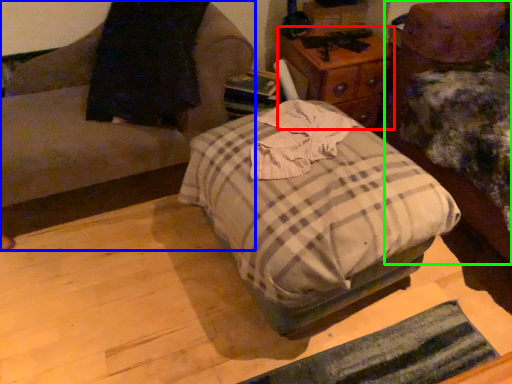
Question: Which object is positioned farthest from nightstand (highlighted by a red box)? Select from furniture (highlighted by a blue box) and furniture (highlighted by a green box).

Choices:
 (A) furniture
 (B) furniture

Answer: (A)